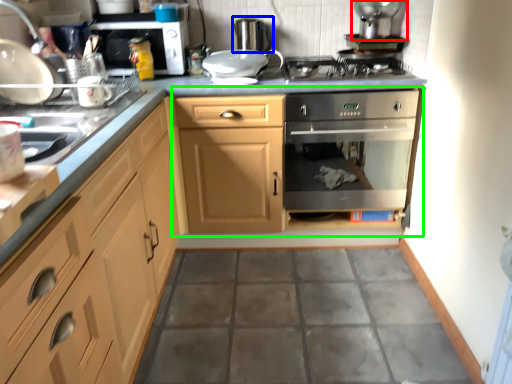
Question: Which is farther away from appliance (highlighted by a red box)? appliance (highlighted by a blue box) or dresser (highlighted by a green box)?

Choices:
 (A) appliance
 (B) dresser

Answer: (B)